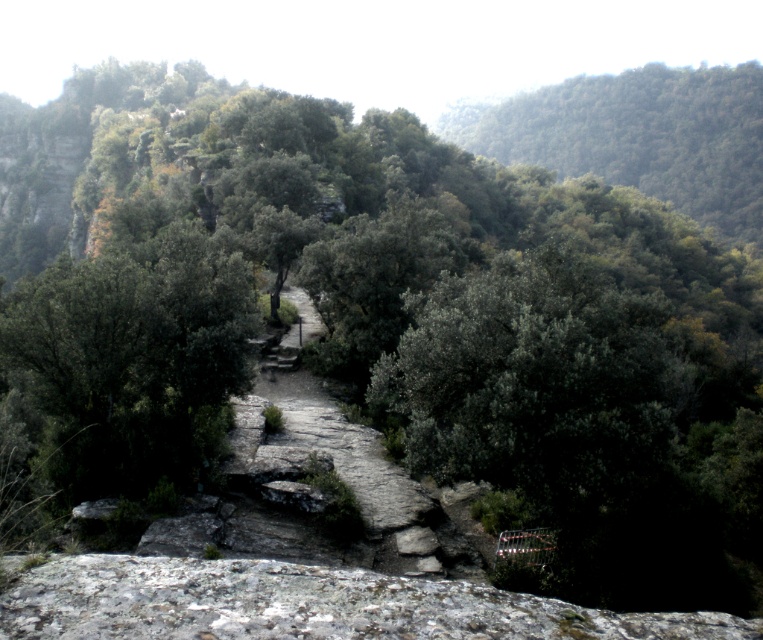
Question: Which of the following is the farthest from the observer?

Choices:
 (A) green leafy tree at upper center
 (B) gray rough rock at lower center

Answer: (A)

Question: In this image, where is gray rough rock at lower center located relative to green leafy tree at upper center?

Choices:
 (A) left
 (B) right

Answer: (A)

Question: Does gray rough rock at lower center come behind green leafy tree at upper center?

Choices:
 (A) yes
 (B) no

Answer: (B)

Question: Among these objects, which one is farthest from the camera?

Choices:
 (A) green leafy tree at upper center
 (B) gray rough rock at lower center

Answer: (A)

Question: Which of the following is the farthest from the observer?

Choices:
 (A) (x=655, y=182)
 (B) (x=26, y=628)

Answer: (A)

Question: In this image, where is gray rough rock at lower center located relative to green leafy tree at upper center?

Choices:
 (A) below
 (B) above

Answer: (A)